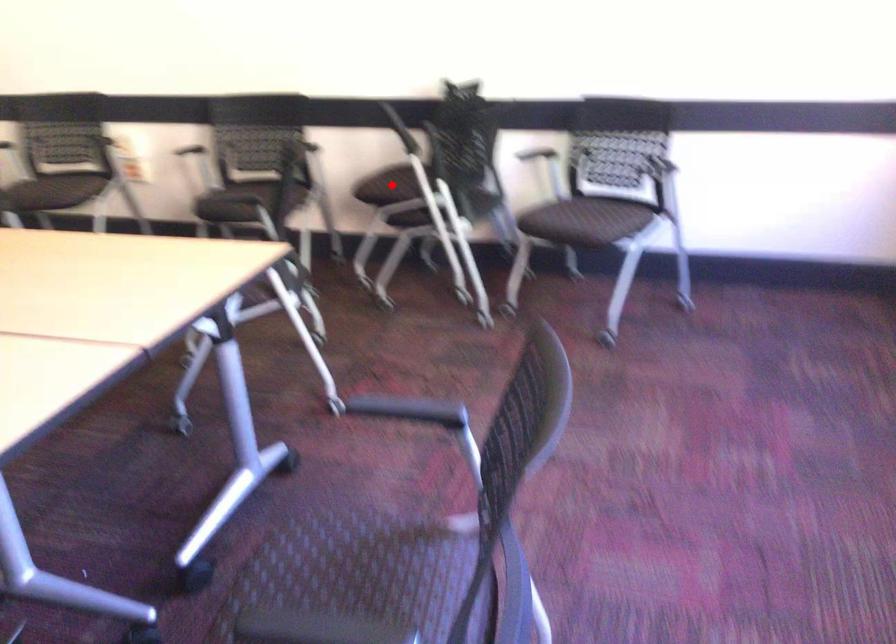
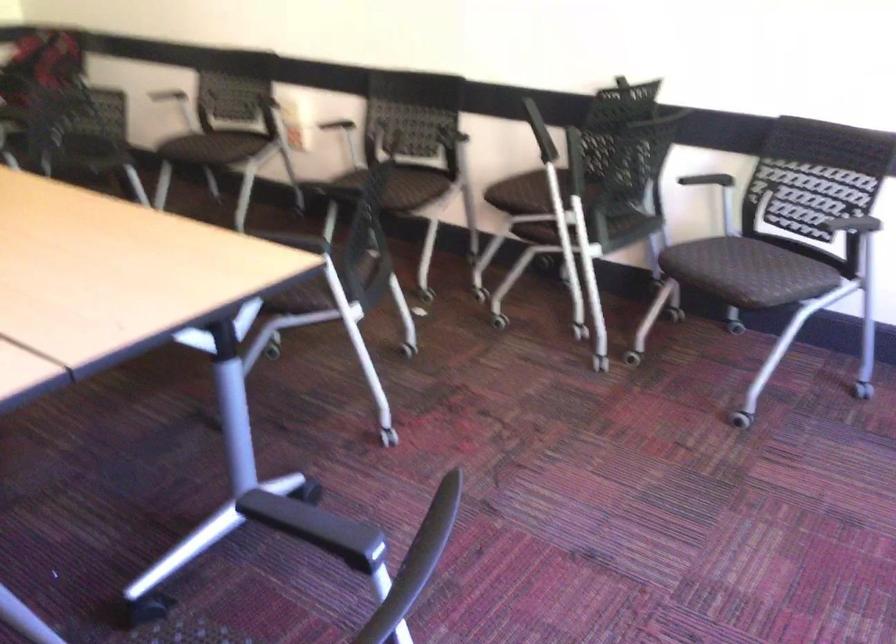
Question: I am providing you with two images of the same scene from different viewpoints. Given a red point in image1, look at the same physical point in image2. Is it:

Choices:
 (A) Closer to the viewpoint
 (B) Farther from the viewpoint

Answer: (A)